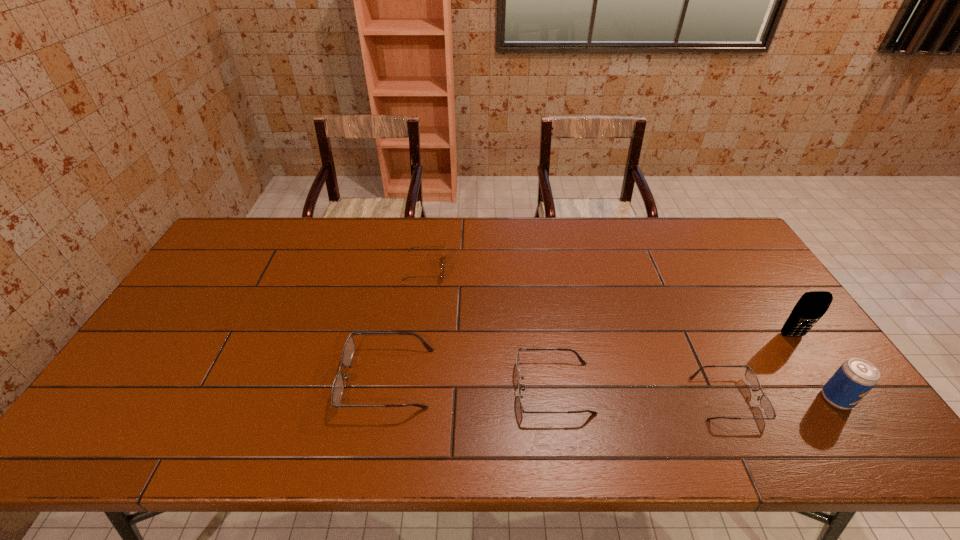
This screenshot has width=960, height=540. What are the coordinates of `object at the far edge` in the screenshot? It's located at (444, 261).

At what (x,y) coordinates should I click in order to perform the action: click on beer can that is positioned at the near edge. Please return your answer as a coordinate pair (x, y). Looking at the image, I should click on (855, 378).

Find the location of a particular element. Image resolution: width=960 pixels, height=540 pixels. cellular telephone at the right edge is located at coordinates (811, 306).

The image size is (960, 540). What are the coordinates of `beer can positioned at the right edge` in the screenshot? It's located at (855, 378).

The height and width of the screenshot is (540, 960). In order to click on object located at the near right corner in this screenshot , I will do `click(855, 378)`.

Identify the location of vacant region at the far edge of the desktop. The image size is (960, 540). (283, 225).

This screenshot has height=540, width=960. In order to click on vacant region at the near edge in this screenshot , I will do `click(769, 394)`.

I want to click on free location at the left edge, so click(x=230, y=290).

Identify the location of free space at the right edge. This screenshot has width=960, height=540. pyautogui.click(x=711, y=271).

In the image, there is a desktop. Where is `vacant space at the far left corner`? The height and width of the screenshot is (540, 960). vacant space at the far left corner is located at coordinates (240, 230).